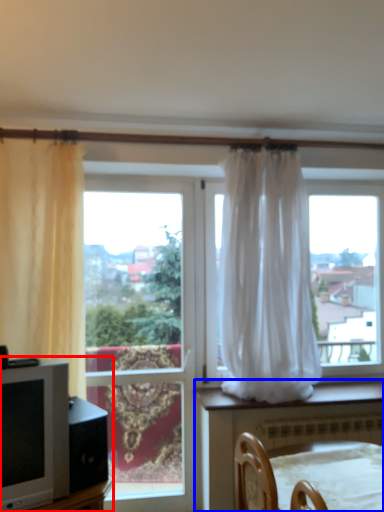
Question: Which object is closer to the camera taking this photo, entertainment center (highlighted by a red box) or furniture (highlighted by a blue box)?

Choices:
 (A) entertainment center
 (B) furniture

Answer: (B)